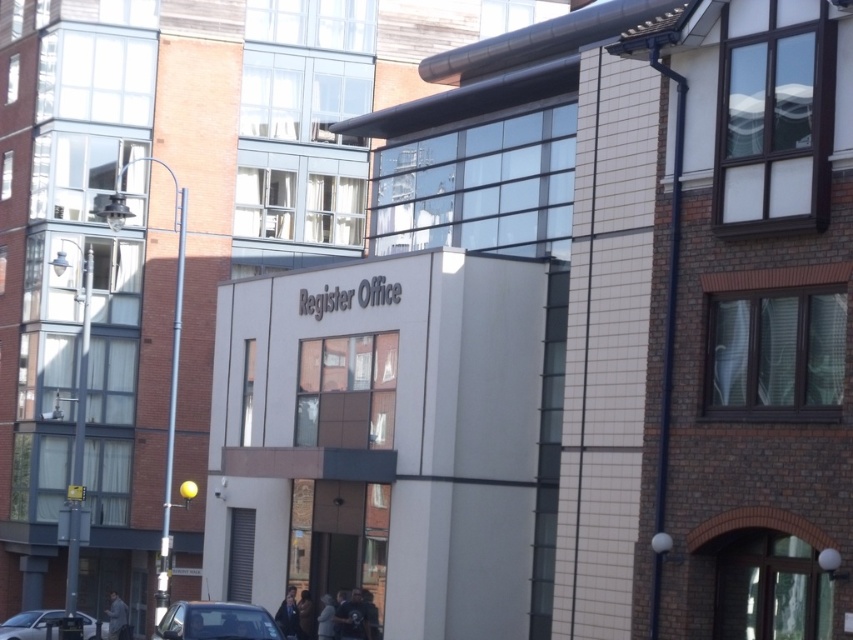
Is the position of metallic silver car at lower center less distant than that of silver metallic car at lower left?

Yes, metallic silver car at lower center is closer to the viewer.

In the scene shown: Can you confirm if metallic silver car at lower center is bigger than silver metallic car at lower left?

No, metallic silver car at lower center is not bigger than silver metallic car at lower left.

What do you see at coordinates (216, 621) in the screenshot? Image resolution: width=853 pixels, height=640 pixels. I see `metallic silver car at lower center` at bounding box center [216, 621].

Locate an element on the screen. metallic silver car at lower center is located at coordinates (216, 621).